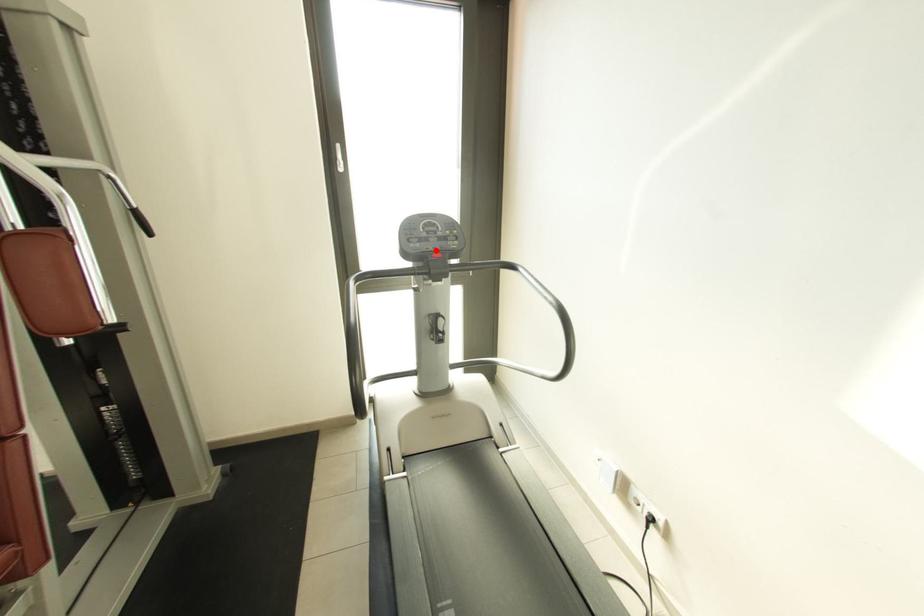
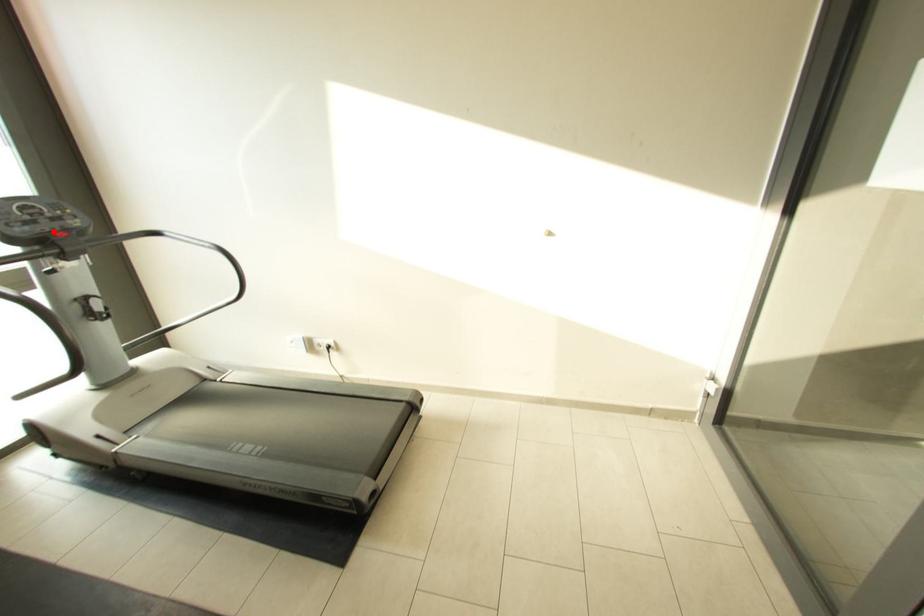
I am providing you with two images of the same scene from different viewpoints. A red point is marked on the first image and another point is marked on the second image. Is the red point in image1 aligned with the point shown in image2?

Yes